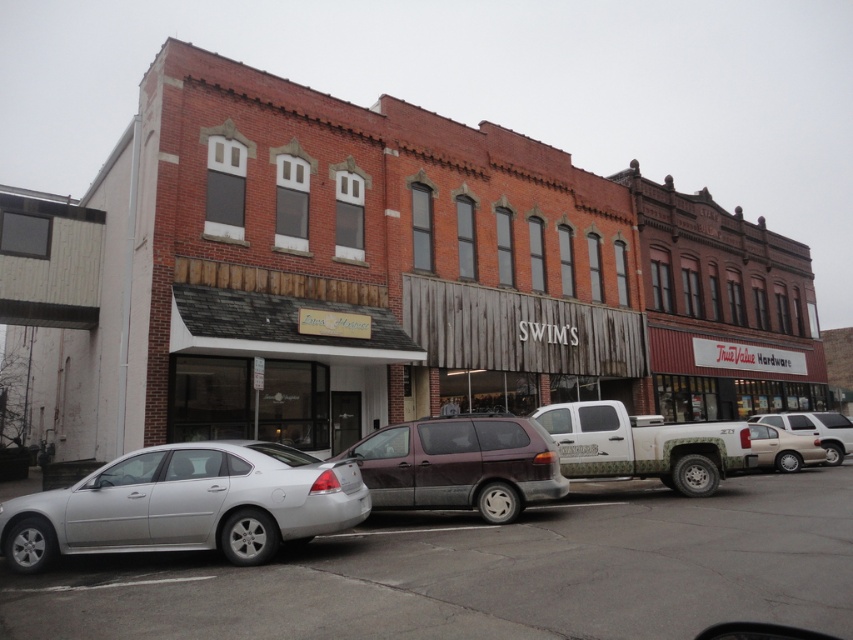
Question: Is silver metallic sedan at lower left wider than silver metallic sedan at right?

Choices:
 (A) yes
 (B) no

Answer: (A)

Question: Does silver metallic car at lower left have a larger size compared to satin burgundy minivan at center?

Choices:
 (A) no
 (B) yes

Answer: (B)

Question: Which point is farther to the camera?

Choices:
 (A) silver metallic sedan at lower left
 (B) camouflage-patterned truck at center
 (C) silver metallic sedan at right
 (D) silver metallic car at lower left

Answer: (C)

Question: Which point is closer to the camera?

Choices:
 (A) (109, 600)
 (B) (759, 458)
 (C) (218, 518)
 (D) (560, 472)

Answer: (A)

Question: Which object appears farthest from the camera in this image?

Choices:
 (A) camouflage-patterned truck at center
 (B) silver metallic sedan at lower left
 (C) silver metallic sedan at right

Answer: (C)

Question: Does satin burgundy minivan at center have a smaller size compared to camouflage-patterned truck at center?

Choices:
 (A) yes
 (B) no

Answer: (B)